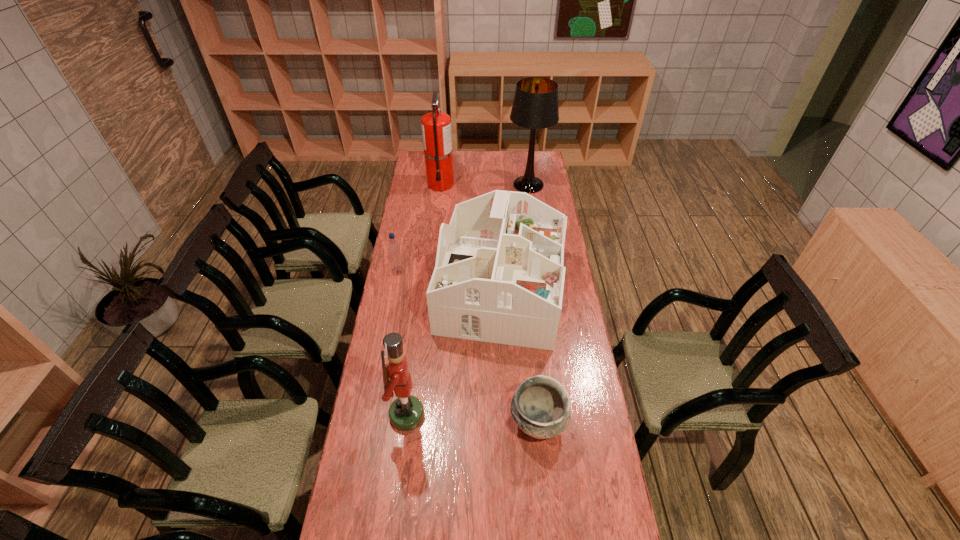
I want to click on vacant space at the right edge of the desktop, so click(584, 432).

This screenshot has width=960, height=540. I want to click on empty location between the leftmost object and the shortest object, so click(x=468, y=346).

This screenshot has width=960, height=540. Identify the location of empty location between the water bottle and the pottery. (468, 346).

Where is `vacant space that is in between the nutcracker and the shortest object`? vacant space that is in between the nutcracker and the shortest object is located at coordinates (472, 418).

In order to click on vacant area between the leftmost object and the pottery in this screenshot , I will do [468, 346].

Identify the location of free space that is in between the fire extinguisher and the water bottle. The width and height of the screenshot is (960, 540). (420, 227).

The image size is (960, 540). What are the coordinates of `blank region between the table lamp and the fire extinguisher` in the screenshot? It's located at (485, 184).

This screenshot has height=540, width=960. Find the location of `object that ranks as the third closest to the leftmost object`. object that ranks as the third closest to the leftmost object is located at coordinates (406, 413).

The image size is (960, 540). Identify the location of the third closest object relative to the table lamp. (393, 248).

Where is `blank space that satisfies the following two spatial constraints: 1. on the front side of the table lamp; 2. on the front-facing side of the nutcracker`? blank space that satisfies the following two spatial constraints: 1. on the front side of the table lamp; 2. on the front-facing side of the nutcracker is located at coordinates (561, 415).